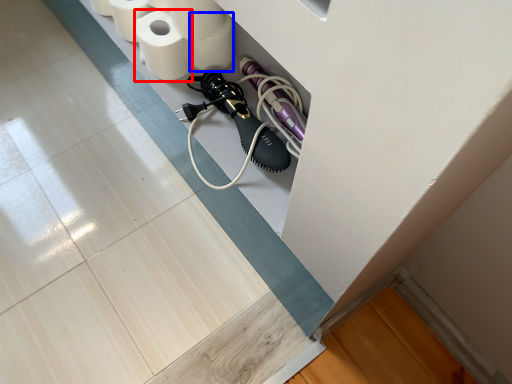
Question: Which point is closer to the camera, toilet paper (highlighted by a red box) or toilet paper (highlighted by a blue box)?

Choices:
 (A) toilet paper
 (B) toilet paper

Answer: (A)